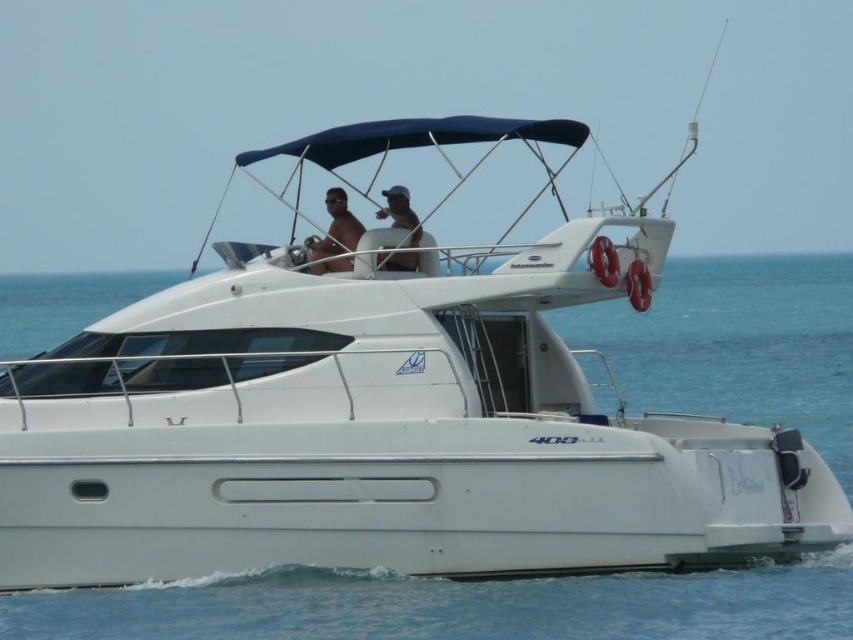
Does point (323, 257) come in front of point (386, 193)?

Yes, it is.

Does matte white shirt at upper center have a lesser width compared to matte white cap at upper center?

Incorrect, matte white shirt at upper center's width is not less than matte white cap at upper center's.

Locate an element on the screen. Image resolution: width=853 pixels, height=640 pixels. matte white shirt at upper center is located at coordinates (335, 228).